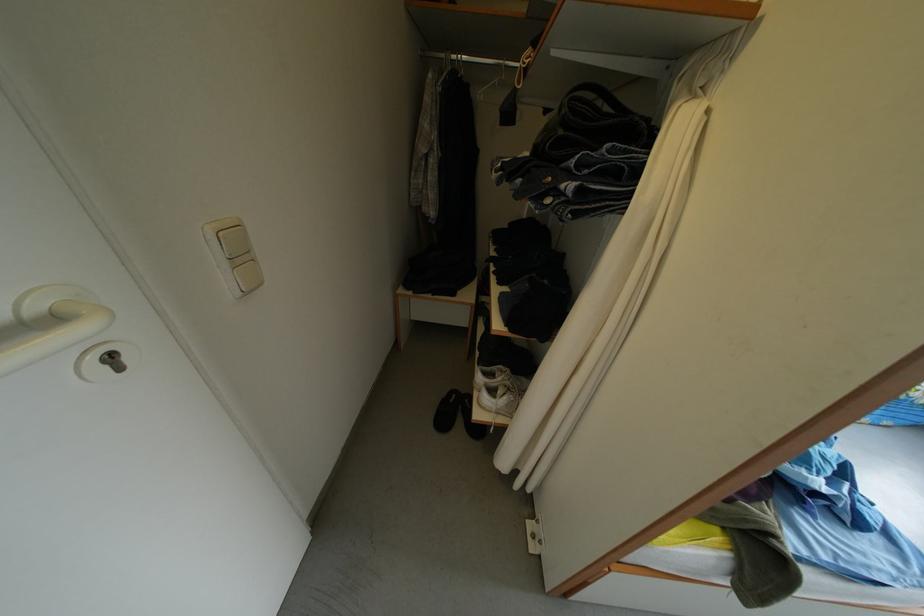
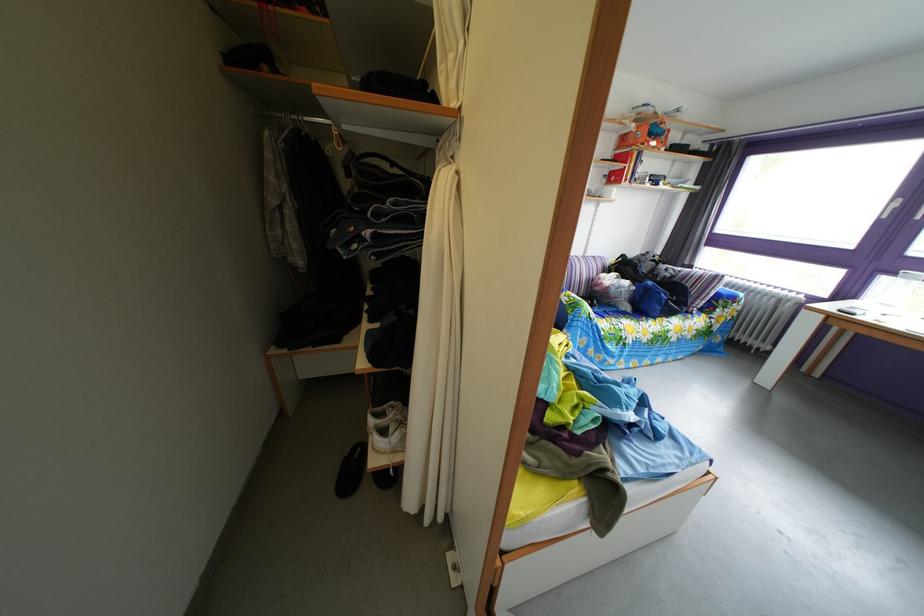
Where in the second image is the point corresponding to point 456,411 from the first image?

(359, 469)